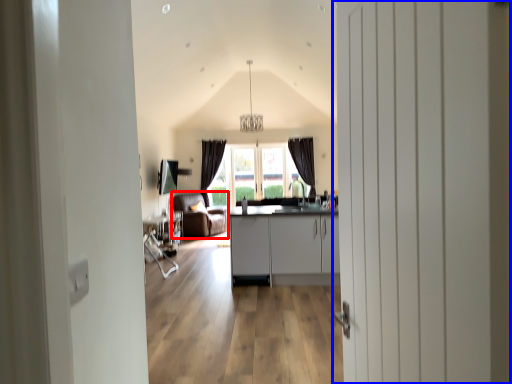
Question: Which object is closer to the camera taking this photo, armchair (highlighted by a red box) or door (highlighted by a blue box)?

Choices:
 (A) armchair
 (B) door

Answer: (B)